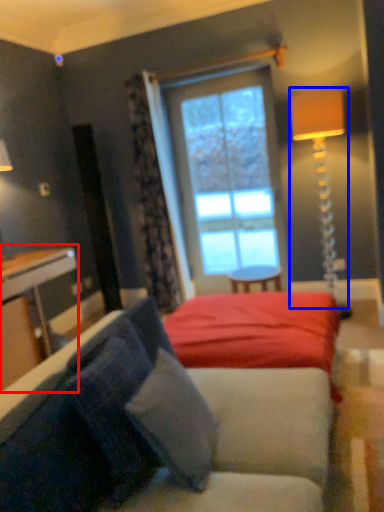
Question: Among these objects, which one is nearest to the camera, table (highlighted by a red box) or table lamp (highlighted by a blue box)?

Choices:
 (A) table
 (B) table lamp

Answer: (A)